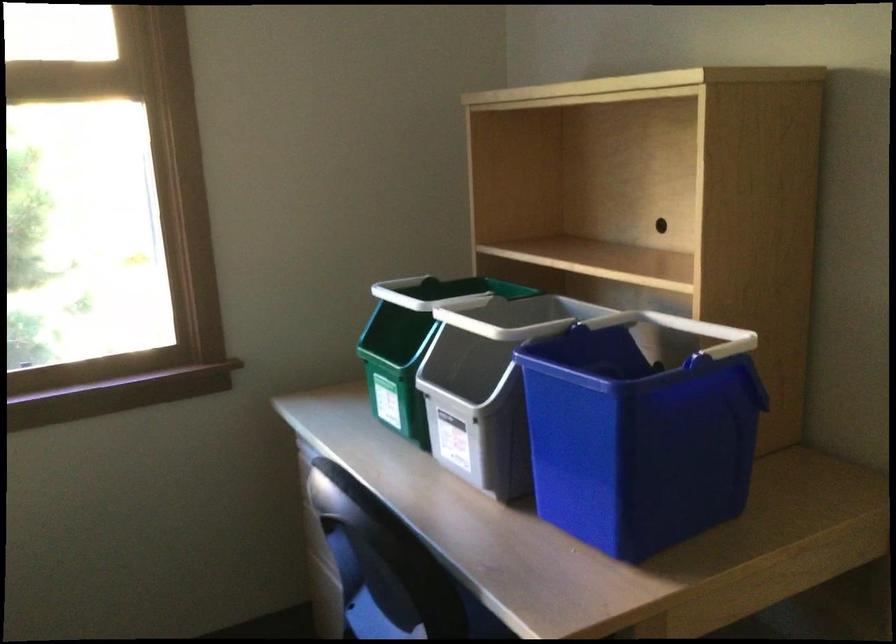
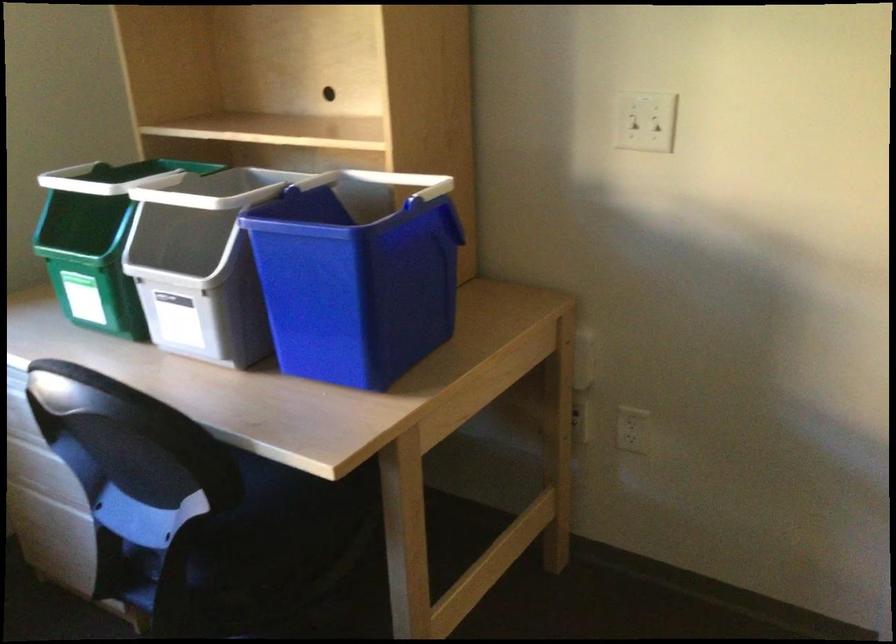
In the second image, find the point that corresponds to [699,327] in the first image.

(399, 181)